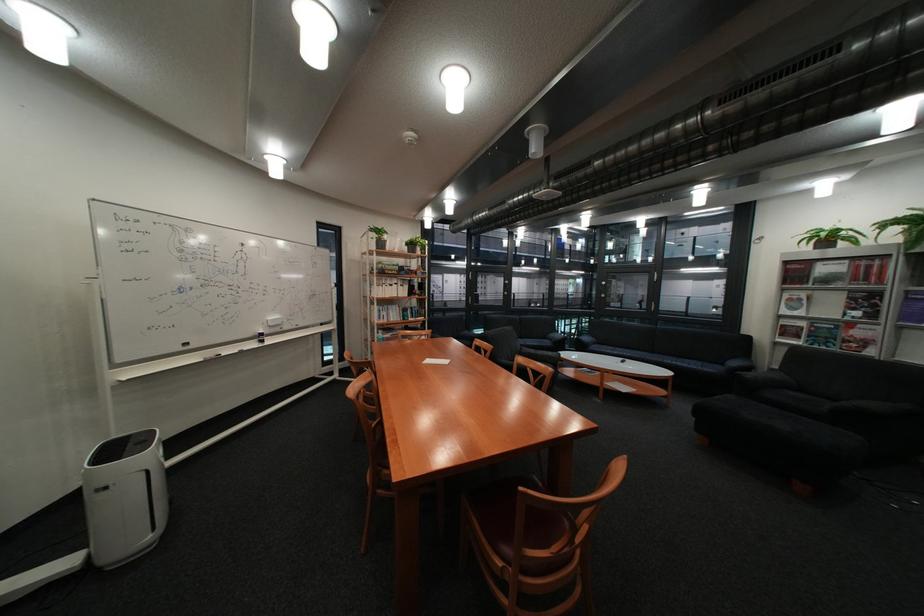
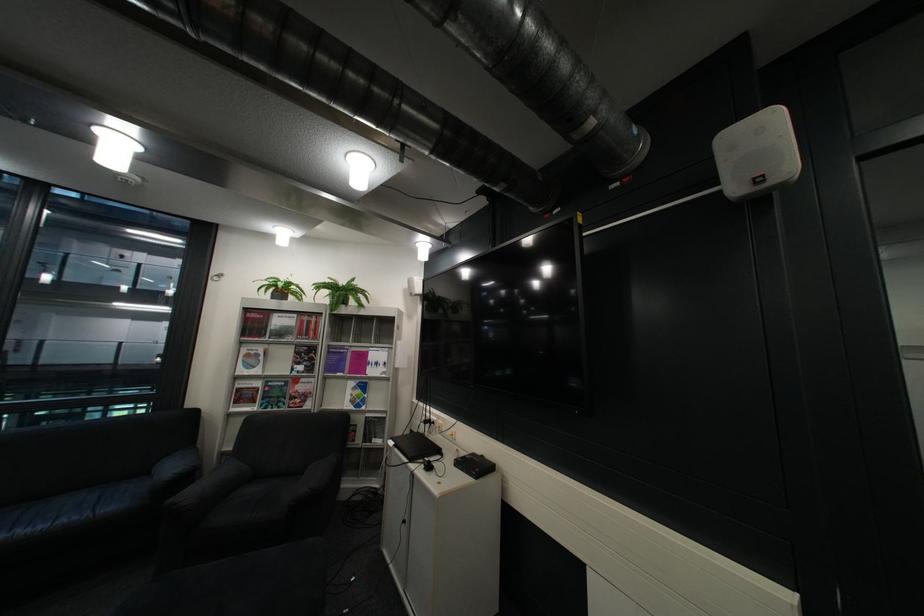
Where in the second image is the point corresponding to point (750, 363) from the first image?

(186, 468)